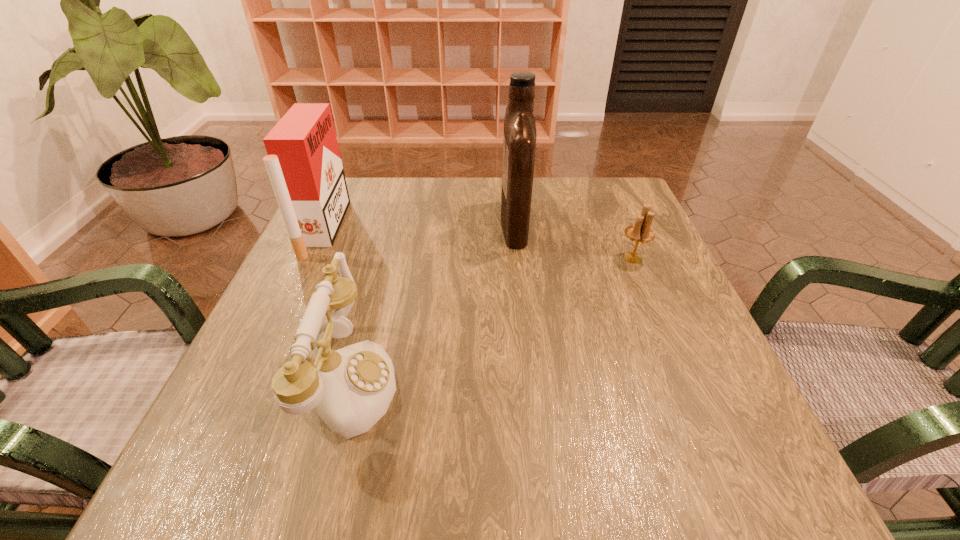
This screenshot has height=540, width=960. What are the coordinates of `vacant space situated 0.230m on the label side of the third object from left to right` in the screenshot? It's located at pyautogui.click(x=404, y=223).

This screenshot has height=540, width=960. I want to click on free region located on the front-facing side of the cigarette case, so click(x=492, y=229).

Identify the location of free space located 0.220m on the dial of the third tallest object. The height and width of the screenshot is (540, 960). (534, 381).

At what (x,y) coordinates should I click in order to perform the action: click on vacant space located 0.200m on the back of the shortest object. Please return your answer as a coordinate pair (x, y). Looking at the image, I should click on [x=610, y=202].

Image resolution: width=960 pixels, height=540 pixels. I want to click on liquor at the far edge, so click(x=519, y=141).

The image size is (960, 540). What are the coordinates of `cigarette case present at the far edge` in the screenshot? It's located at (304, 165).

Find the location of a particular element. object situated at the near edge is located at coordinates (352, 387).

Locate an element on the screen. The height and width of the screenshot is (540, 960). cigarette case present at the left edge is located at coordinates pos(304,165).

You are a GUI agent. You are given a task and a screenshot of the screen. Output one action in this format:
    pyautogui.click(x=<x>, y=<y>)
    Task: Click on the telephone at the left edge
    The width and height of the screenshot is (960, 540).
    Given the screenshot: What is the action you would take?
    pyautogui.click(x=352, y=387)

Locate an element on the screen. object that is positioned at the right edge is located at coordinates (640, 232).